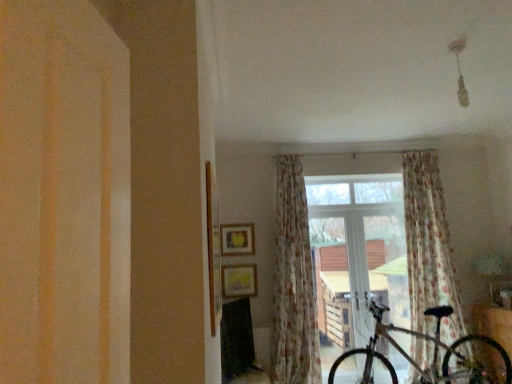
Question: Can you confirm if transparent glass window at center is positioned to the right of matte yellow picture frame at center, which appears as the 2th picture frame when ordered from the bottom?

Choices:
 (A) no
 (B) yes

Answer: (B)

Question: Is transparent glass window at center to the left of matte yellow picture frame at center, which appears as the 2th picture frame when ordered from the bottom, from the viewer's perspective?

Choices:
 (A) no
 (B) yes

Answer: (A)

Question: Can you confirm if transparent glass window at center is thinner than matte yellow picture frame at center, the 1th picture frame when ordered from top to bottom?

Choices:
 (A) yes
 (B) no

Answer: (B)

Question: From the image's perspective, does transparent glass window at center appear higher than matte yellow picture frame at center, which appears as the 2th picture frame when ordered from the bottom?

Choices:
 (A) yes
 (B) no

Answer: (B)

Question: Is transparent glass window at center next to matte yellow picture frame at center, which appears as the 2th picture frame when ordered from the bottom, and touching it?

Choices:
 (A) yes
 (B) no

Answer: (B)

Question: Is transparent glass window at center looking in the opposite direction of matte yellow picture frame at center, which appears as the 2th picture frame when ordered from the bottom?

Choices:
 (A) yes
 (B) no

Answer: (B)

Question: Does metallic silver bicycle at center appear on the right side of matte yellow picture frame at center, which appears as the 2th picture frame when ordered from the bottom?

Choices:
 (A) no
 (B) yes

Answer: (B)

Question: Does metallic silver bicycle at center have a larger size compared to matte yellow picture frame at center, which appears as the 2th picture frame when ordered from the bottom?

Choices:
 (A) no
 (B) yes

Answer: (B)

Question: From the image's perspective, is metallic silver bicycle at center located above matte yellow picture frame at center, which appears as the 2th picture frame when ordered from the bottom?

Choices:
 (A) no
 (B) yes

Answer: (A)

Question: Is metallic silver bicycle at center not within matte yellow picture frame at center, the 1th picture frame when ordered from top to bottom?

Choices:
 (A) yes
 (B) no

Answer: (A)

Question: Would you say metallic silver bicycle at center is a long distance from matte yellow picture frame at center, which appears as the 2th picture frame when ordered from the bottom?

Choices:
 (A) no
 (B) yes

Answer: (B)

Question: Are metallic silver bicycle at center and matte yellow picture frame at center, which appears as the 2th picture frame when ordered from the bottom, beside each other?

Choices:
 (A) no
 (B) yes

Answer: (A)

Question: Would you say transparent glass window at center is part of floral fabric curtain at center, arranged as the second curtain when viewed from the left,'s contents?

Choices:
 (A) yes
 (B) no

Answer: (B)